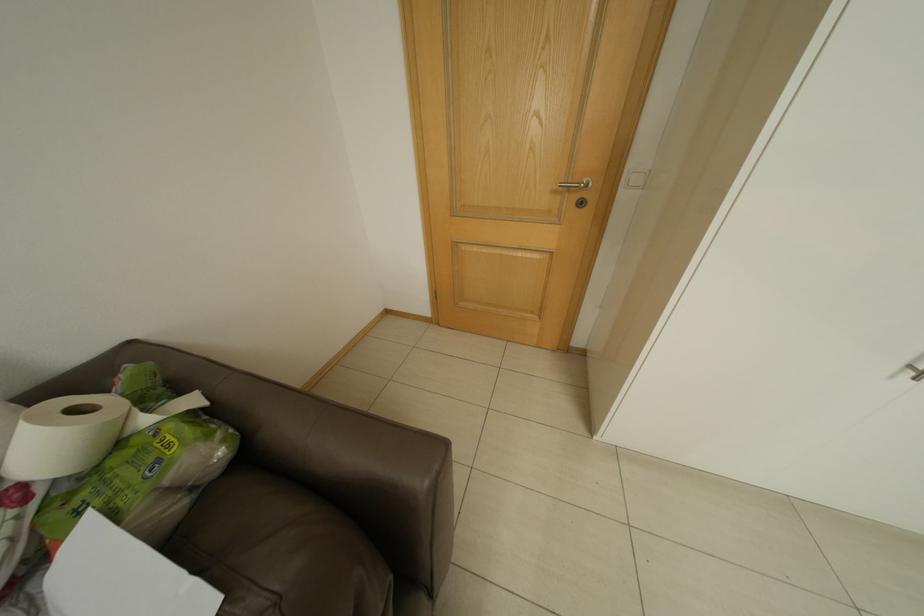
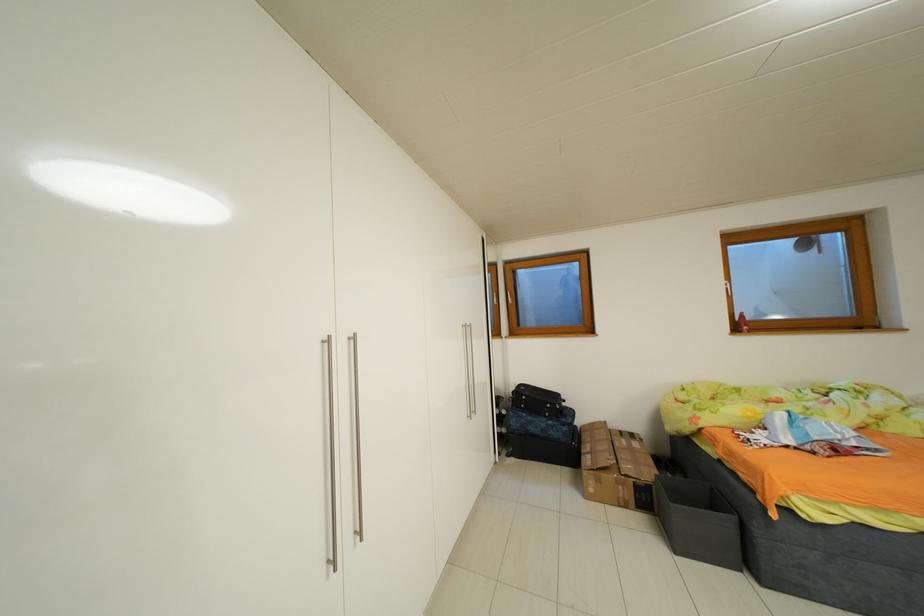
Question: The first image is from the beginning of the video and the second image is from the end. How did the camera likely rotate when shooting the video?

Choices:
 (A) Left
 (B) Right
 (C) Up
 (D) Down

Answer: (B)